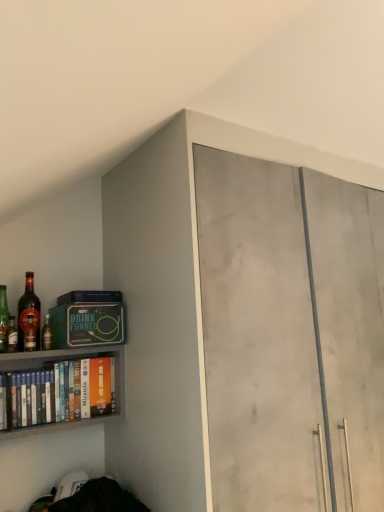
Question: Is point (14, 330) positioned closer to the camera than point (87, 380)?

Choices:
 (A) closer
 (B) farther

Answer: (A)

Question: Considering their positions, is shiny glass bottle at left, acting as the 2th bottle starting from the left, located in front of or behind white matte book at left?

Choices:
 (A) behind
 (B) front

Answer: (A)

Question: Considering the real-world distances, which object is closest to the matte concrete cabinet at upper right?

Choices:
 (A) shiny brown glass bottle at left, the 3th bottle in the left-to-right sequence
 (B) matte glass bottle at left, the fourth bottle from the right
 (C) white matte book at left
 (D) matte glass bottle at left, positioned as the first bottle in right-to-left order
 (E) shiny glass bottle at left, acting as the 2th bottle starting from the left

Answer: (C)

Question: Which object is positioned farthest from the matte glass bottle at left, which is the 4th bottle from left to right?

Choices:
 (A) matte glass bottle at left, placed as the first bottle when sorted from left to right
 (B) matte concrete cabinet at upper right
 (C) white matte book at left
 (D) shiny glass bottle at left, acting as the 2th bottle starting from the left
 (E) shiny brown glass bottle at left, the 3th bottle in the left-to-right sequence

Answer: (B)